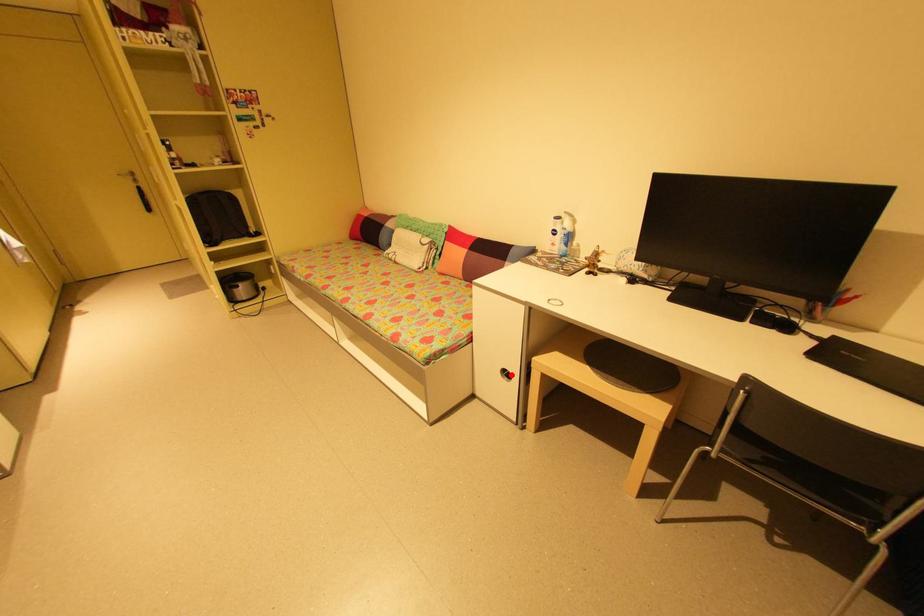
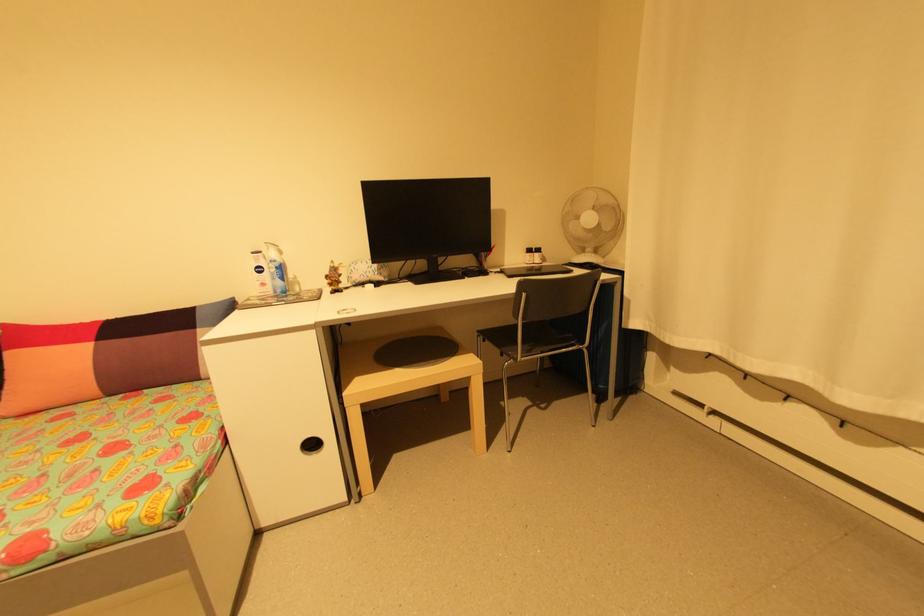
Question: I am providing you with two images of the same scene from different viewpoints. Given a red point in image1, look at the same physical point in image2. Is it:

Choices:
 (A) Closer to the viewpoint
 (B) Farther from the viewpoint

Answer: (B)